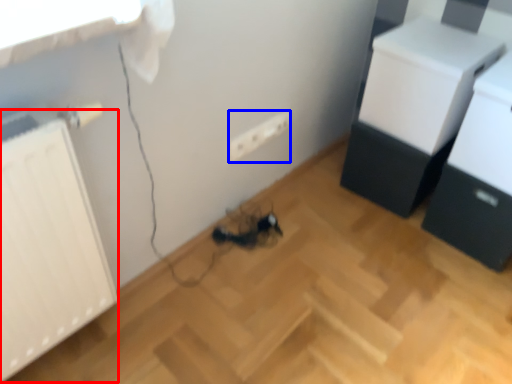
Question: Which point is further to the camera, radiator (highlighted by a red box) or electric outlet (highlighted by a blue box)?

Choices:
 (A) radiator
 (B) electric outlet

Answer: (B)